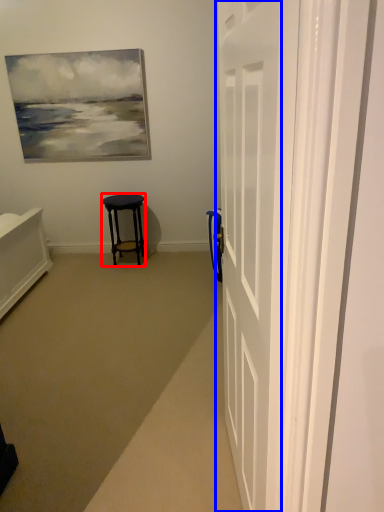
Question: Which point is closer to the camera, stool (highlighted by a red box) or door (highlighted by a blue box)?

Choices:
 (A) stool
 (B) door

Answer: (B)